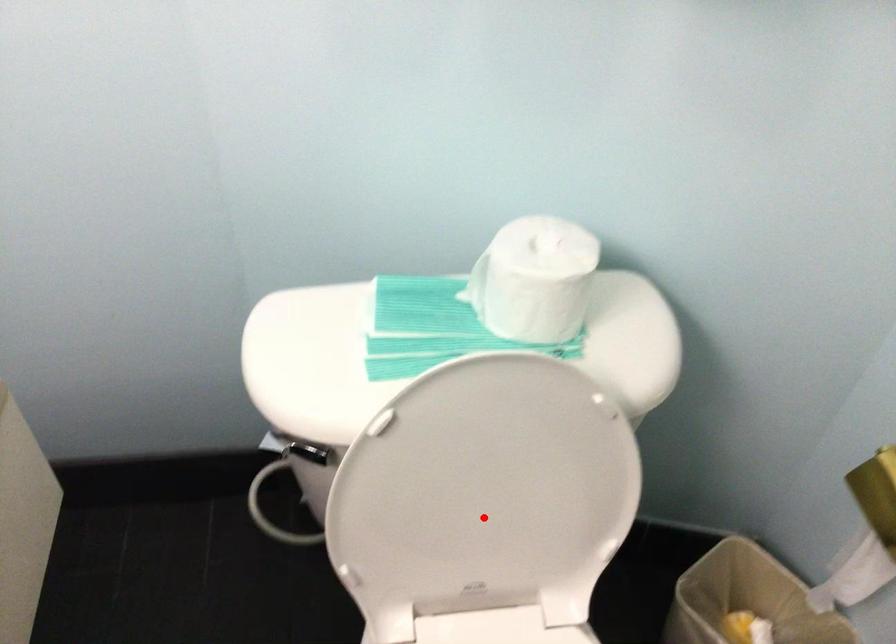
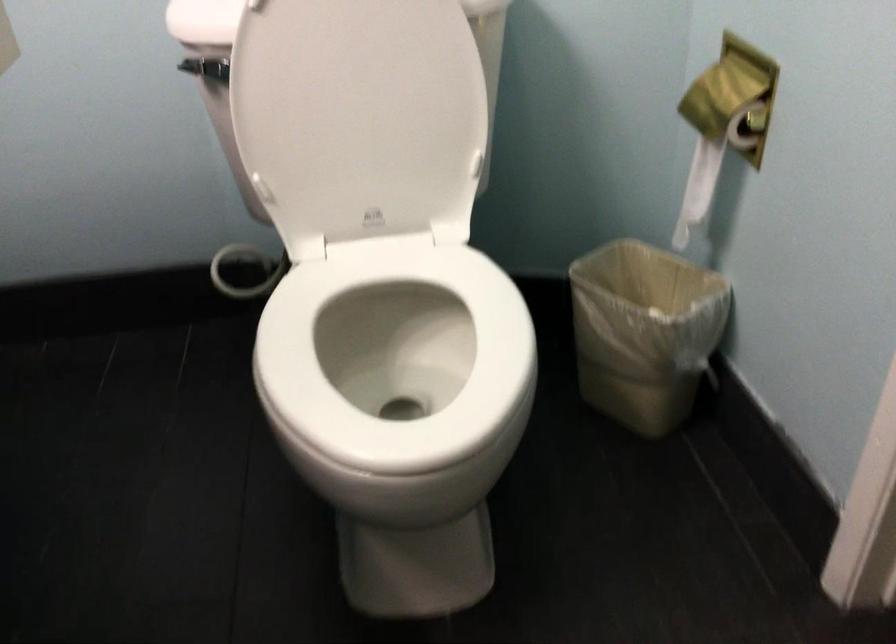
Where in the second image is the point corresponding to the highlighted location from the first image?

(359, 114)